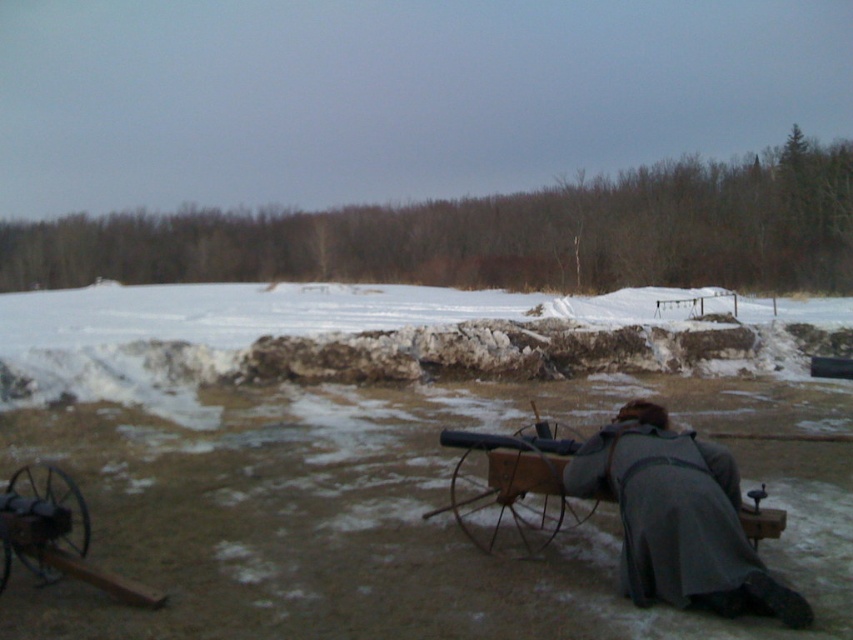
You are a historical reenactor preparing to move your equipment. You have the gray wool coat at lower center and the wooden wagon at center. Which item can you carry more easily?

The gray wool coat at lower center is smaller than the wooden wagon at center, so it can be carried more easily.

You are a historical reenactor preparing to demonstrate a winter scene. You need to position a gray wool coat at lower center and a wooden cannon at lower left in the scene. Based on the spatial relationship between them, which object should be placed higher up to match the original image?

The gray wool coat at lower center is taller than the wooden cannon at lower left, so the gray wool coat at lower center should be placed higher up to match the original image.

You are a costume designer preparing for a historical reenactment. You need to ensure that the gray wool coat at lower center will not interfere with the actor performing a crouching action. Based on its position in the image, can you determine if the coat is long enough to cover the actor when they crouch?

The gray wool coat at lower center is positioned at point (677, 518), which indicates it is located in the lower central area of the image. However, without specific measurements or visibility of the coat length relative to the actor when crouching, it is not possible to determine if the coat is long enough to cover them during the action.